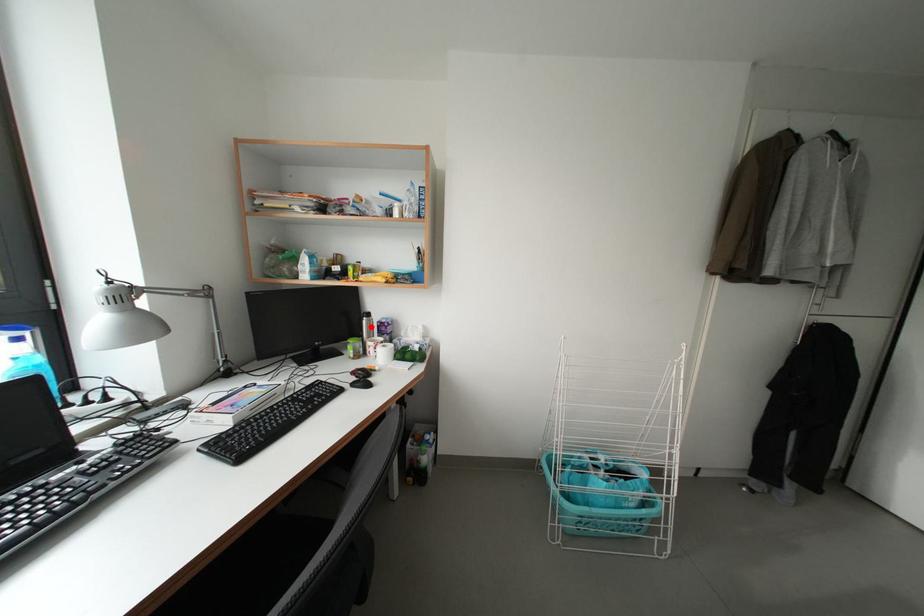
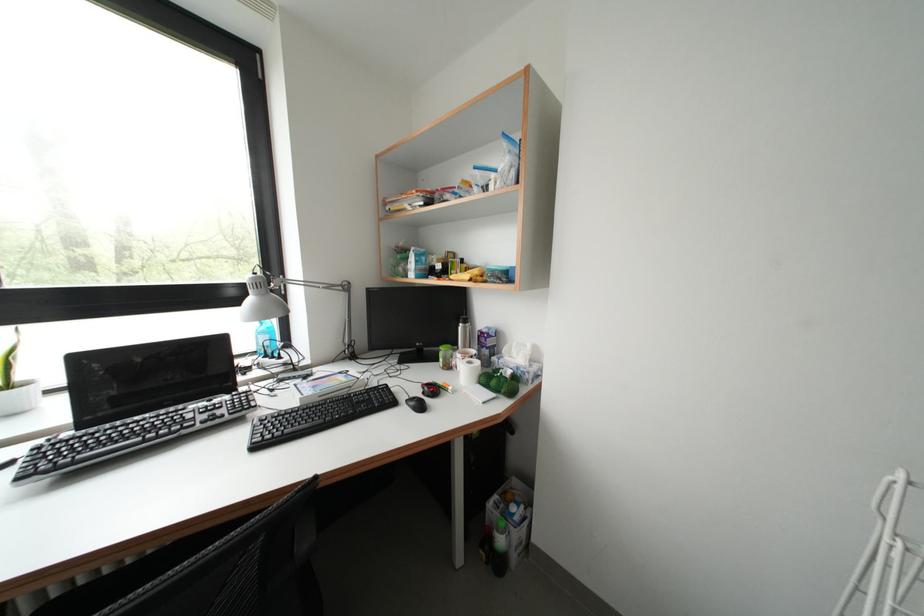
In the second image, find the point that corresponds to the highlighted location in the first image.

(467, 333)